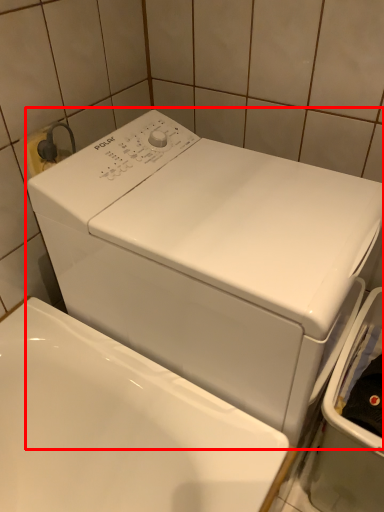
Question: From the image's perspective, where is washing machine (annotated by the red box) located relative to dish washer?

Choices:
 (A) above
 (B) below

Answer: (A)